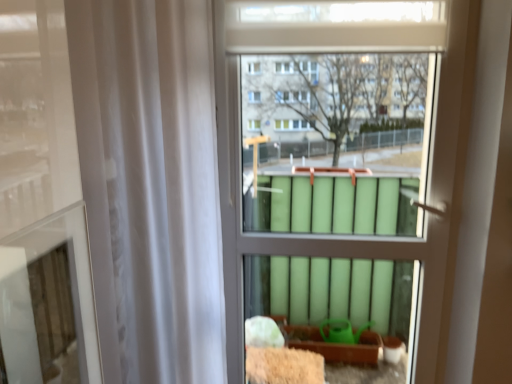
Question: Should I look upward or downward to see white sheer curtain at left?

Choices:
 (A) down
 (B) up

Answer: (A)

Question: Is white sheer curtain at left at the right side of green matte radiator at center?

Choices:
 (A) no
 (B) yes

Answer: (A)

Question: Can you confirm if white sheer curtain at left is bigger than green matte radiator at center?

Choices:
 (A) no
 (B) yes

Answer: (B)

Question: Is green matte radiator at center at the back of white sheer curtain at left?

Choices:
 (A) yes
 (B) no

Answer: (B)

Question: Can you confirm if white sheer curtain at left is smaller than green matte radiator at center?

Choices:
 (A) yes
 (B) no

Answer: (B)

Question: Does white sheer curtain at left appear on the left side of green matte radiator at center?

Choices:
 (A) yes
 (B) no

Answer: (A)

Question: Does white sheer curtain at left have a lesser height compared to green matte radiator at center?

Choices:
 (A) yes
 (B) no

Answer: (A)

Question: Is green matte radiator at center outside of white sheer curtain at left?

Choices:
 (A) no
 (B) yes

Answer: (B)

Question: Can you confirm if green matte radiator at center is thinner than white sheer curtain at left?

Choices:
 (A) yes
 (B) no

Answer: (A)

Question: From a real-world perspective, is green matte radiator at center physically above white sheer curtain at left?

Choices:
 (A) yes
 (B) no

Answer: (B)

Question: From the image's perspective, is green matte radiator at center above white sheer curtain at left?

Choices:
 (A) yes
 (B) no

Answer: (A)

Question: Can you confirm if green matte radiator at center is bigger than white sheer curtain at left?

Choices:
 (A) yes
 (B) no

Answer: (B)

Question: Considering the relative sizes of green matte radiator at center and white sheer curtain at left in the image provided, is green matte radiator at center shorter than white sheer curtain at left?

Choices:
 (A) yes
 (B) no

Answer: (B)

Question: Is green matte radiator at center spatially inside white sheer curtain at left, or outside of it?

Choices:
 (A) outside
 (B) inside

Answer: (A)